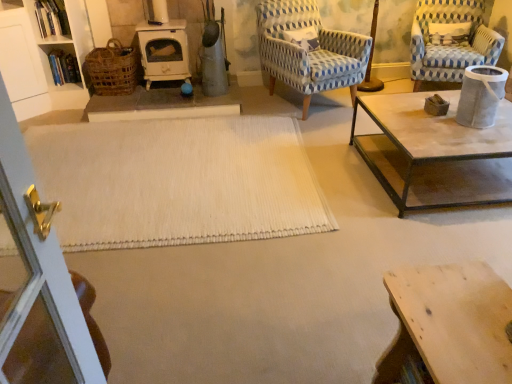
Question: From the image's perspective, is woven brown basket at left located beneath white woven rug at center?

Choices:
 (A) no
 (B) yes

Answer: (A)

Question: Can you confirm if woven brown basket at left is wider than white woven rug at center?

Choices:
 (A) no
 (B) yes

Answer: (A)

Question: From a real-world perspective, is woven brown basket at left physically below white woven rug at center?

Choices:
 (A) no
 (B) yes

Answer: (A)

Question: Does woven brown basket at left have a lesser height compared to white woven rug at center?

Choices:
 (A) no
 (B) yes

Answer: (A)

Question: Does woven brown basket at left have a lesser width compared to white woven rug at center?

Choices:
 (A) no
 (B) yes

Answer: (B)

Question: Can you confirm if woven brown basket at left is bigger than white woven rug at center?

Choices:
 (A) no
 (B) yes

Answer: (A)

Question: From a real-world perspective, is blue woven fabric chair at upper right, placed as the second chair when sorted from right to left, beneath woven brown basket at left?

Choices:
 (A) yes
 (B) no

Answer: (B)

Question: Does blue woven fabric chair at upper right, which appears as the first chair when viewed from the left, come behind woven brown basket at left?

Choices:
 (A) yes
 (B) no

Answer: (B)

Question: From the image's perspective, does blue woven fabric chair at upper right, which appears as the first chair when viewed from the left, appear higher than woven brown basket at left?

Choices:
 (A) no
 (B) yes

Answer: (B)

Question: Considering the relative sizes of blue woven fabric chair at upper right, placed as the second chair when sorted from right to left, and woven brown basket at left in the image provided, is blue woven fabric chair at upper right, placed as the second chair when sorted from right to left, wider than woven brown basket at left?

Choices:
 (A) no
 (B) yes

Answer: (B)

Question: Can we say blue woven fabric chair at upper right, placed as the second chair when sorted from right to left, lies outside woven brown basket at left?

Choices:
 (A) no
 (B) yes

Answer: (B)

Question: Considering the relative sizes of blue woven fabric chair at upper right, which appears as the first chair when viewed from the left, and woven brown basket at left in the image provided, is blue woven fabric chair at upper right, which appears as the first chair when viewed from the left, bigger than woven brown basket at left?

Choices:
 (A) yes
 (B) no

Answer: (A)

Question: Is wooden table at lower right a part of blue woven fabric chair at upper right, which appears as the first chair when viewed from the left?

Choices:
 (A) yes
 (B) no

Answer: (B)